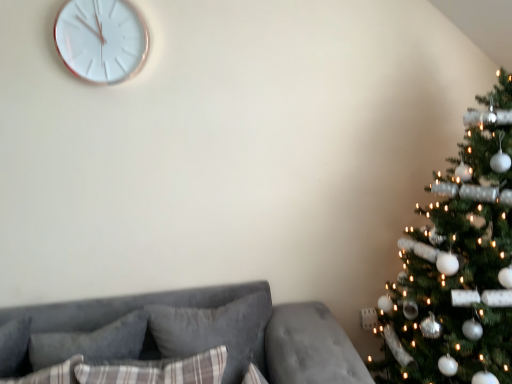
Question: From the image's perspective, would you say plush gray pillow at lower left, acting as the second pillow starting from the front, is shown under velvet gray couch at lower left?

Choices:
 (A) no
 (B) yes

Answer: (A)

Question: Is plush gray pillow at lower left, which appears as the second pillow when viewed from the back, shorter than velvet gray couch at lower left?

Choices:
 (A) yes
 (B) no

Answer: (A)

Question: Is plush gray pillow at lower left, which appears as the second pillow when viewed from the back, completely or partially outside of velvet gray couch at lower left?

Choices:
 (A) no
 (B) yes

Answer: (A)

Question: From a real-world perspective, does plush gray pillow at lower left, which appears as the second pillow when viewed from the back, sit lower than velvet gray couch at lower left?

Choices:
 (A) yes
 (B) no

Answer: (B)

Question: Is plush gray pillow at lower left, which appears as the second pillow when viewed from the back, oriented away from velvet gray couch at lower left?

Choices:
 (A) yes
 (B) no

Answer: (A)

Question: From a real-world perspective, is plush gray pillow at lower left, acting as the second pillow starting from the front, over velvet gray couch at lower left?

Choices:
 (A) yes
 (B) no

Answer: (A)

Question: Considering the relative sizes of plaid fabric pillow at center, which is the first pillow in front-to-back order, and velvet gray couch at lower left in the image provided, is plaid fabric pillow at center, which is the first pillow in front-to-back order, smaller than velvet gray couch at lower left?

Choices:
 (A) no
 (B) yes

Answer: (B)

Question: Can you confirm if plaid fabric pillow at center, which ranks as the 3th pillow in back-to-front order, is positioned to the right of velvet gray couch at lower left?

Choices:
 (A) yes
 (B) no

Answer: (A)

Question: Can you confirm if plaid fabric pillow at center, which ranks as the 3th pillow in back-to-front order, is thinner than velvet gray couch at lower left?

Choices:
 (A) no
 (B) yes

Answer: (B)

Question: Is plaid fabric pillow at center, which ranks as the 3th pillow in back-to-front order, aimed at velvet gray couch at lower left?

Choices:
 (A) no
 (B) yes

Answer: (B)

Question: From a real-world perspective, does plaid fabric pillow at center, which is the first pillow in front-to-back order, stand above velvet gray couch at lower left?

Choices:
 (A) yes
 (B) no

Answer: (A)

Question: Is plaid fabric pillow at center, which is the first pillow in front-to-back order, taller than velvet gray couch at lower left?

Choices:
 (A) no
 (B) yes

Answer: (A)

Question: Is the depth of green textured christmas tree at right greater than that of velvet gray couch at lower left?

Choices:
 (A) no
 (B) yes

Answer: (A)